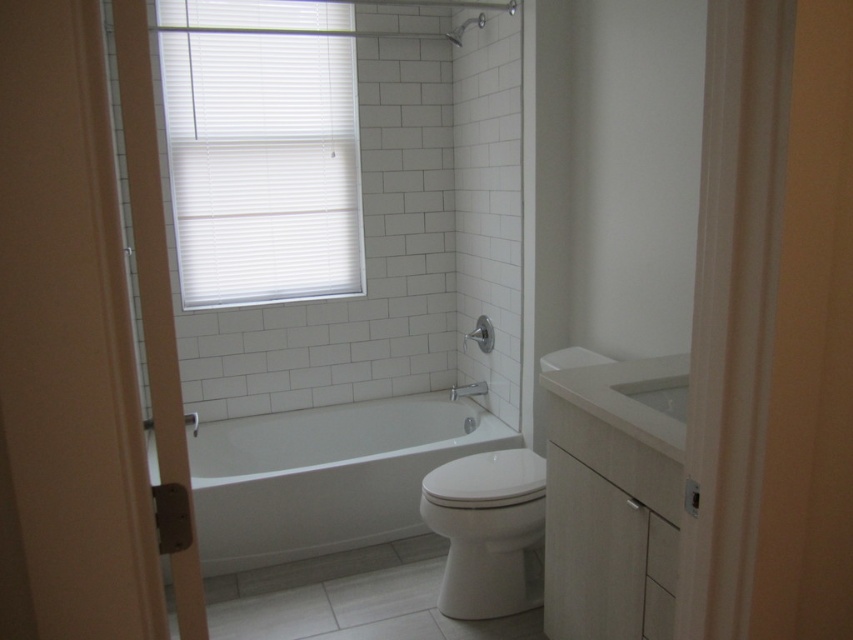
Question: Which point is farther to the camera?

Choices:
 (A) matte white shower at center
 (B) white glossy sink at center
 (C) white glossy toilet at center
 (D) white blinds at upper left

Answer: (A)

Question: Does white glossy toilet at center have a greater width compared to white glossy sink at center?

Choices:
 (A) no
 (B) yes

Answer: (B)

Question: Can you confirm if white blinds at upper left is positioned below matte silver showerhead at upper center?

Choices:
 (A) yes
 (B) no

Answer: (A)

Question: Considering the real-world distances, which object is closest to the white glossy bathtub at center?

Choices:
 (A) matte white shower at center
 (B) matte silver showerhead at upper center
 (C) white glossy sink at center

Answer: (A)

Question: Which object is the farthest from the white blinds at upper left?

Choices:
 (A) white glossy bathtub at center
 (B) matte silver showerhead at upper center
 (C) white glossy sink at center
 (D) matte white shower at center

Answer: (C)

Question: Considering the relative positions of white glossy sink at center and matte white shower at center in the image provided, where is white glossy sink at center located with respect to matte white shower at center?

Choices:
 (A) right
 (B) left

Answer: (A)